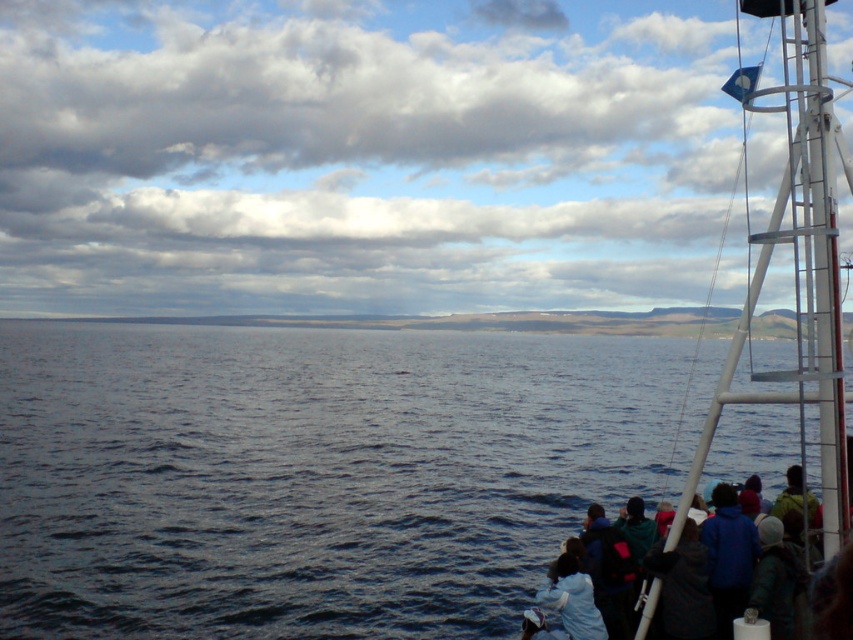
Is dark blue water at center below white metal boat at right?

Yes, dark blue water at center is below white metal boat at right.

Is dark blue water at center thinner than white metal boat at right?

Incorrect, dark blue water at center's width is not less than white metal boat at right's.

The height and width of the screenshot is (640, 853). I want to click on dark blue water at center, so click(309, 474).

Where is `dark blue water at center`? The image size is (853, 640). dark blue water at center is located at coordinates (309, 474).

Can you confirm if dark blue water at center is positioned below blue jacket at lower right?

Actually, dark blue water at center is above blue jacket at lower right.

Is dark blue water at center bigger than blue jacket at lower right?

Yes, dark blue water at center is bigger than blue jacket at lower right.

Is point (143, 445) closer to camera compared to point (842, 557)?

No.

This screenshot has width=853, height=640. I want to click on dark blue water at center, so click(x=309, y=474).

Which is above, white metal boat at right or blue jacket at lower right?

Positioned higher is white metal boat at right.

Which is more to the left, white metal boat at right or blue jacket at lower right?

blue jacket at lower right is more to the left.

Locate an element on the screen. This screenshot has height=640, width=853. white metal boat at right is located at coordinates (798, 259).